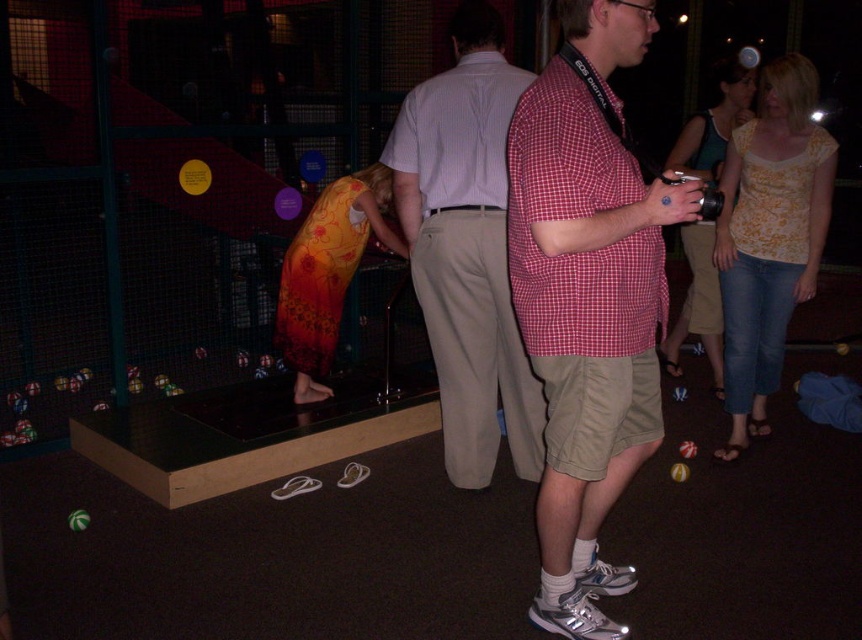
You are a photographer trying to capture both the red checkered shirt at center and the light brown cotton pants at center in a single frame. Based on their heights, which clothing item will require you to adjust your camera angle upwards to include its entirety?

The light brown cotton pants at center is taller than the red checkered shirt at center, so you will need to adjust your camera angle upwards to include the entirety of the light brown cotton pants at center.

You are standing in the museum and want to take a photo of the display case. The red checkered shirt at center and the light brown cotton pants at center are blocking your view. Which one should you move to get a clear shot?

You should move the red checkered shirt at center because it is in front of the light brown cotton pants at center, making it the closer obstruction to your line of sight.

You are a photographer trying to capture both the red checkered shirt at center and the light brown cotton pants at center in the same frame. Which object should you position closer to the left side of your camera viewfinder to ensure both are included?

The light brown cotton pants at center should be positioned closer to the left side of your camera viewfinder because the red checkered shirt at center is already on the right side of the light brown cotton pants at center.